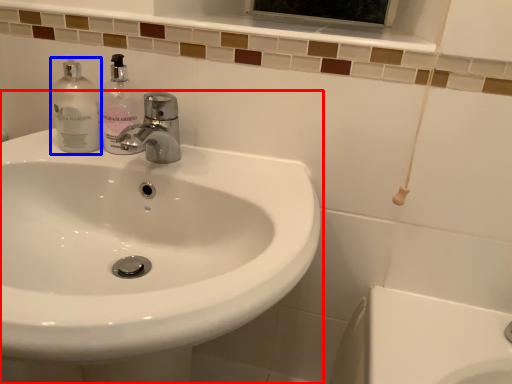
Question: Which object appears farthest to the camera in this image, sink (highlighted by a red box) or cleaning product (highlighted by a blue box)?

Choices:
 (A) sink
 (B) cleaning product

Answer: (B)